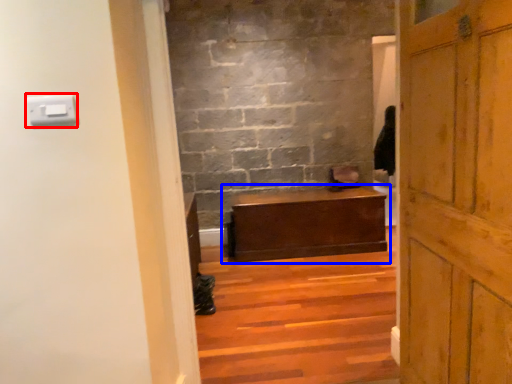
Question: Which object is closer to the camera taking this photo, light switch (highlighted by a red box) or table (highlighted by a blue box)?

Choices:
 (A) light switch
 (B) table

Answer: (A)